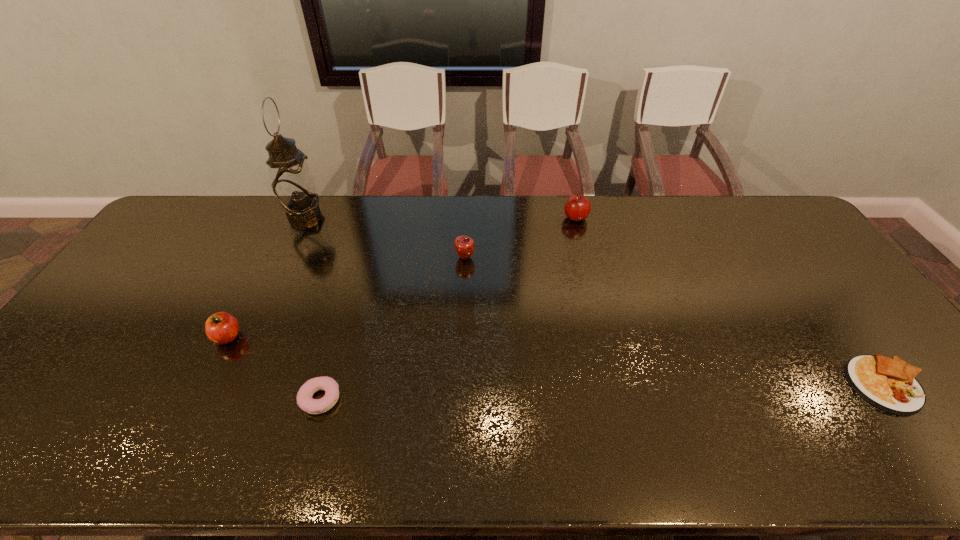
This screenshot has width=960, height=540. I want to click on the rightmost object, so click(x=889, y=384).

Locate an element on the screen. The height and width of the screenshot is (540, 960). vacant space situated 0.130m on the right of the tallest object is located at coordinates (359, 214).

The width and height of the screenshot is (960, 540). Find the location of `vacant area situated 0.210m on the right of the fifth object from left to right`. vacant area situated 0.210m on the right of the fifth object from left to right is located at coordinates (648, 218).

This screenshot has width=960, height=540. I want to click on vacant space situated on the right of the fourth object from left to right, so click(499, 258).

Where is `vacant space situated on the right of the leftmost apple`? This screenshot has width=960, height=540. vacant space situated on the right of the leftmost apple is located at coordinates (357, 337).

Locate an element on the screen. free region located 0.220m on the back of the fifth tallest object is located at coordinates (345, 314).

Where is `vacant region located 0.120m on the back of the rightmost object`? vacant region located 0.120m on the back of the rightmost object is located at coordinates click(839, 321).

Image resolution: width=960 pixels, height=540 pixels. In order to click on oil lamp located at the far edge in this screenshot , I will do `click(292, 182)`.

I want to click on apple that is at the far edge, so click(578, 207).

The height and width of the screenshot is (540, 960). I want to click on object positioned at the right edge, so click(889, 384).